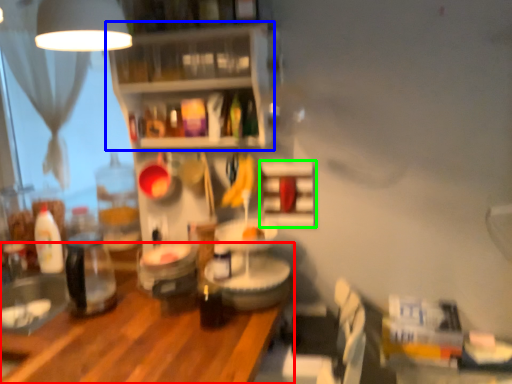
Question: Considering the real-world distances, which object is closest to table (highlighted by a red box)? shelf (highlighted by a blue box) or shelf (highlighted by a green box).

Choices:
 (A) shelf
 (B) shelf

Answer: (B)